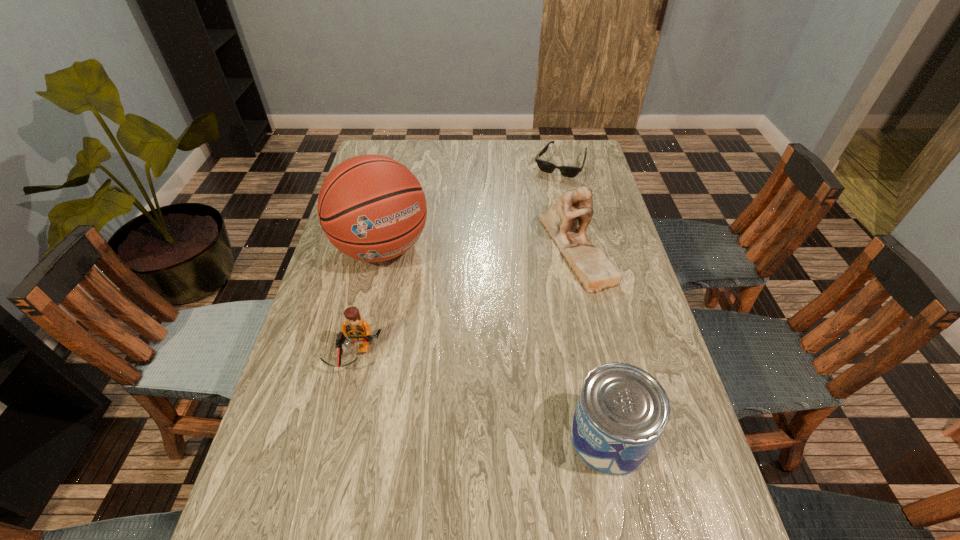
Where is `free spot on the desktop that is between the second shortest object and the third tallest object and is positioned on the front-facing side of the figurine`? The width and height of the screenshot is (960, 540). free spot on the desktop that is between the second shortest object and the third tallest object and is positioned on the front-facing side of the figurine is located at coordinates (494, 401).

You are a GUI agent. You are given a task and a screenshot of the screen. Output one action in this format:
    pyautogui.click(x=<x>, y=<y>)
    Task: Click on the vacant space on the desktop that is between the second nearest object and the nearest object and is positioned on the front-facing side of the sunglasses
    Image resolution: width=960 pixels, height=540 pixels.
    Given the screenshot: What is the action you would take?
    pyautogui.click(x=443, y=384)

The width and height of the screenshot is (960, 540). I want to click on vacant space on the desktop that is between the fourth tallest object and the nearest object and is positioned on the logo side of the tallest object, so click(x=480, y=396).